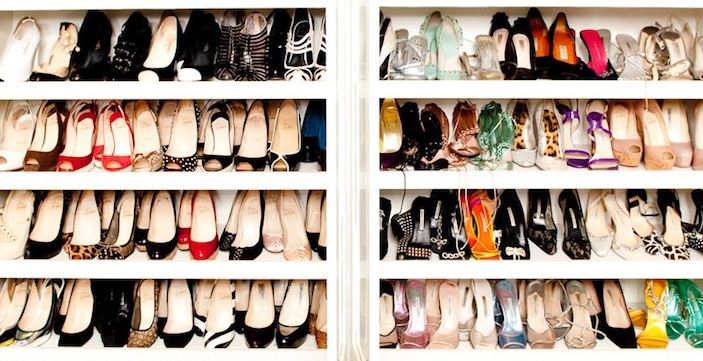
Where is `shelves`? The width and height of the screenshot is (703, 361). shelves is located at coordinates (134, 92), (141, 179), (143, 267), (154, 353), (486, 351), (491, 268), (491, 179), (491, 84).